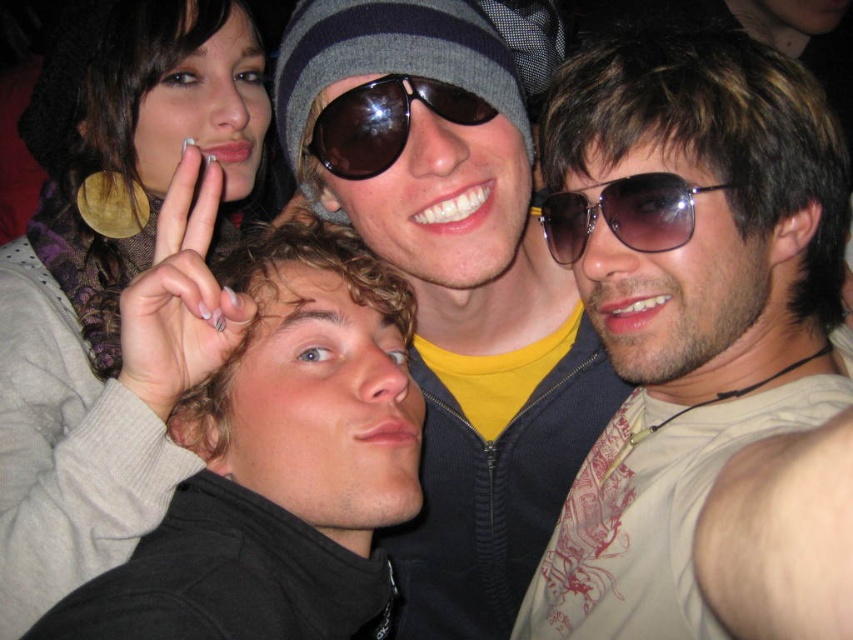
How far apart are matte gray sunglasses at center and dark brown curly hair at center?

matte gray sunglasses at center is 12.90 inches away from dark brown curly hair at center.

I want to click on matte gray sunglasses at center, so click(x=697, y=340).

Can you confirm if matte gray sunglasses at center is positioned below matte black jacket at center?

No, matte gray sunglasses at center is not below matte black jacket at center.

Which of these two, matte gray sunglasses at center or matte black jacket at center, stands shorter?

matte gray sunglasses at center is shorter.

Where is `matte gray sunglasses at center`? The width and height of the screenshot is (853, 640). matte gray sunglasses at center is located at coordinates (697, 340).

From the picture: Is matte black jacket at center positioned in front of metallic aviator sunglasses at center?

Yes, matte black jacket at center is closer to the viewer.

Is matte black jacket at center behind metallic aviator sunglasses at center?

No, it is not.

Who is more forward, (502, 262) or (555, 204)?

Positioned in front is point (502, 262).

The image size is (853, 640). In order to click on matte black jacket at center in this screenshot , I will do `click(456, 275)`.